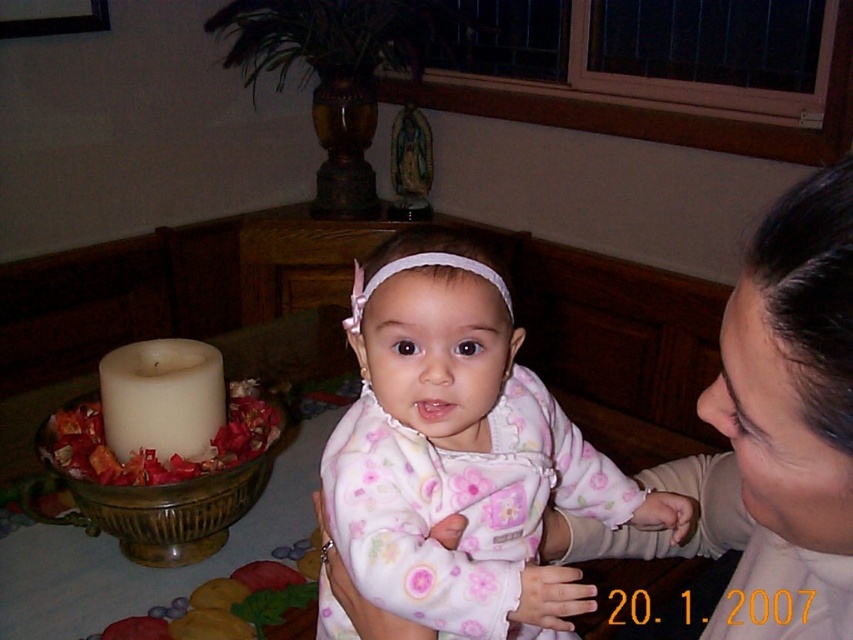
You are a photographer setting up a shoot in this room. You need to position a small prop between the fluffy pink pajamas at center and the smooth beige sweater at upper right. Where should you place it so it is between them?

You should place the prop below the smooth beige sweater at upper right and above the fluffy pink pajamas at center since the fluffy pink pajamas at center is located below the smooth beige sweater at upper right.

Consider the image. You are a tailor measuring the distance between two items of clothing in the image. The items are the fluffy pink pajamas at center and the smooth beige sweater at upper right. The tailor needs to know if they are at least 6 inches apart to ensure proper storage. Can you confirm if they meet this requirement?

The fluffy pink pajamas at center and the smooth beige sweater at upper right are 6.52 inches apart from each other, which exceeds the 6 inches requirement. Therefore, they meet the storage distance requirement.